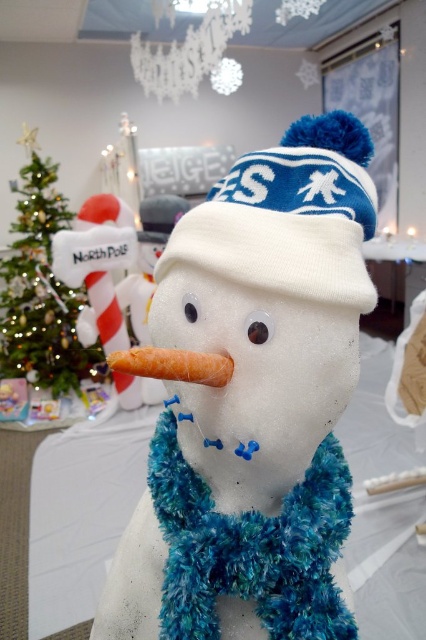
Question: Which object is positioned closest to the white fabric snowman at center?

Choices:
 (A) white knit hat at center
 (B) green shiny christmas tree at left
 (C) fuzzy blue scarf at center
 (D) carrot at center

Answer: (C)

Question: Is fuzzy blue scarf at center above white knit hat at center?

Choices:
 (A) no
 (B) yes

Answer: (A)

Question: Is white knit hat at center further to camera compared to carrot at center?

Choices:
 (A) no
 (B) yes

Answer: (B)

Question: Which of the following is the farthest from the observer?

Choices:
 (A) carrot at center
 (B) green shiny christmas tree at left
 (C) white knit hat at center
 (D) white fabric snowman at center

Answer: (B)

Question: Which object is positioned closest to the white fabric snowman at center?

Choices:
 (A) green shiny christmas tree at left
 (B) white knit hat at center

Answer: (B)

Question: Does green shiny christmas tree at left have a greater width compared to carrot at center?

Choices:
 (A) yes
 (B) no

Answer: (A)